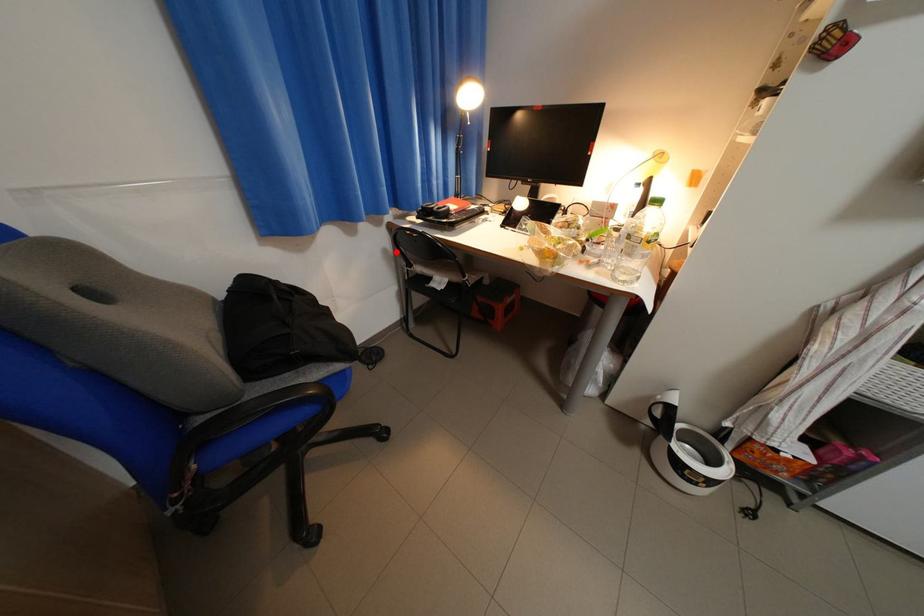
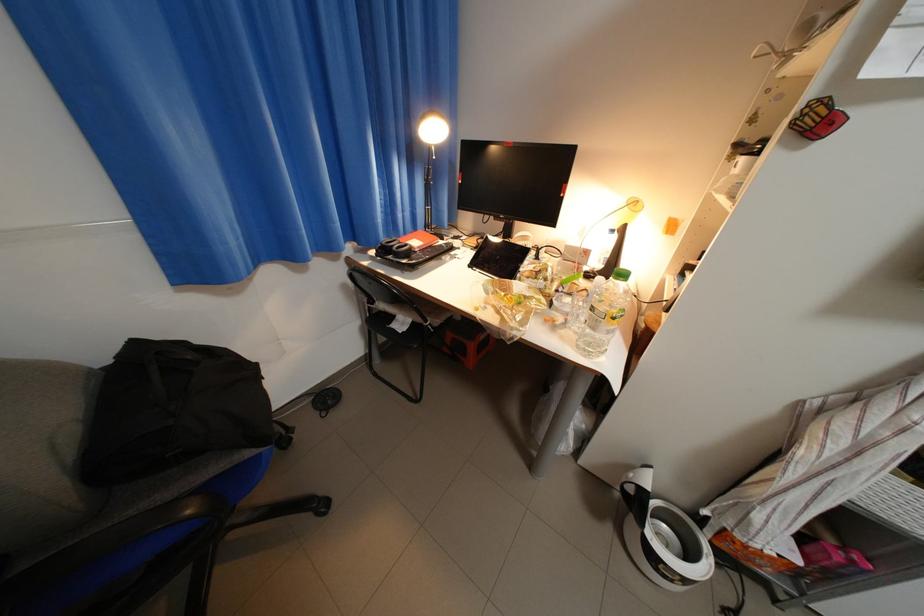
Find the pixel in the second image that matches the highlighted location in the first image.

(355, 286)